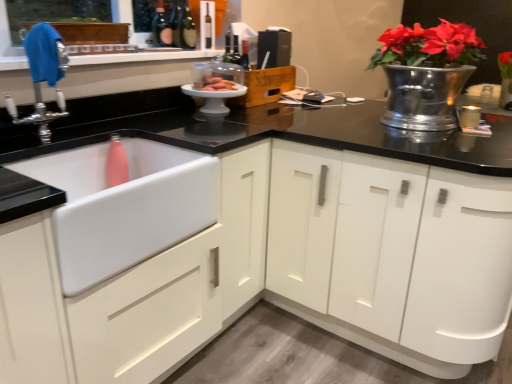
I want to click on white matte sink at lower left, so click(129, 213).

Image resolution: width=512 pixels, height=384 pixels. What do you see at coordinates (219, 85) in the screenshot?
I see `pink matte water bottle at center` at bounding box center [219, 85].

Find the location of a particular element. dark brown glass wine bottle at upper center is located at coordinates (187, 28).

What do you see at coordinates (187, 28) in the screenshot?
I see `dark brown glass wine bottle at upper center` at bounding box center [187, 28].

At what (x,y) coordinates should I click in order to perform the action: click on chrome metallic faucet at upper left. Please return your answer as a coordinate pair (x, y). Looking at the image, I should click on (42, 76).

What do you see at coordinates (42, 76) in the screenshot? I see `chrome metallic faucet at upper left` at bounding box center [42, 76].

Where is `white glossy cabinet at center`? Image resolution: width=512 pixels, height=384 pixels. white glossy cabinet at center is located at coordinates (392, 254).

You are a GUI agent. You are given a task and a screenshot of the screen. Output one action in this format:
    pyautogui.click(x=<x>, y=<y>)
    Task: Click on the white matte sink at lower left
    The height and width of the screenshot is (384, 512).
    Given the screenshot: What is the action you would take?
    pyautogui.click(x=129, y=213)

Is pink matte water bottle at center far away from dark brown glass wine bottle at upper center?

They are positioned close to each other.

Considering the relative sizes of pink matte water bottle at center and dark brown glass wine bottle at upper center in the image provided, is pink matte water bottle at center shorter than dark brown glass wine bottle at upper center?

Yes.

Considering the positions of points (230, 81) and (184, 4), is point (230, 81) farther from camera compared to point (184, 4)?

No, (230, 81) is in front of (184, 4).

From the image's perspective, which one is positioned lower, black matte speaker at upper center, which is counted as the 2th appliance, starting from the bottom, or white ceramic cake stand at center, marked as the second appliance in a back-to-front arrangement?

white ceramic cake stand at center, marked as the second appliance in a back-to-front arrangement.

The height and width of the screenshot is (384, 512). I want to click on appliance in front of the black matte speaker at upper center, marked as the 2th appliance in a front-to-back arrangement, so click(x=216, y=94).

Is black matte speaker at upper center, marked as the 2th appliance in a front-to-back arrangement, taller or shorter than white ceramic cake stand at center, the first appliance in the bottom-to-top sequence?

Considering their sizes, black matte speaker at upper center, marked as the 2th appliance in a front-to-back arrangement, has more height than white ceramic cake stand at center, the first appliance in the bottom-to-top sequence.

Relative to white ceramic cake stand at center, which appears as the 1th appliance when viewed from the front, is black matte speaker at upper center, which appears as the first appliance when viewed from the back, in front or behind?

Visually, black matte speaker at upper center, which appears as the first appliance when viewed from the back, is located behind white ceramic cake stand at center, which appears as the 1th appliance when viewed from the front.

Does point (138, 234) appear closer or farther from the camera than point (213, 106)?

Point (138, 234) is positioned closer to the camera compared to point (213, 106).

Considering the sizes of objects white matte sink at lower left and white ceramic cake stand at center, marked as the second appliance in a back-to-front arrangement, in the image provided, who is bigger, white matte sink at lower left or white ceramic cake stand at center, marked as the second appliance in a back-to-front arrangement,?

white matte sink at lower left.

Looking at this image, from the image's perspective, is white matte sink at lower left located beneath white ceramic cake stand at center, the first appliance in the bottom-to-top sequence?

Correct, white matte sink at lower left appears lower than white ceramic cake stand at center, the first appliance in the bottom-to-top sequence, in the image.

Consider the image. Is white matte sink at lower left shorter than white ceramic cake stand at center, the first appliance in the bottom-to-top sequence?

In fact, white matte sink at lower left may be taller than white ceramic cake stand at center, the first appliance in the bottom-to-top sequence.

Is dark brown glass wine bottle at upper center wider or thinner than white glossy cabinet at center?

Considering their sizes, dark brown glass wine bottle at upper center looks slimmer than white glossy cabinet at center.

Looking at this image, considering the sizes of objects dark brown glass wine bottle at upper center and white glossy cabinet at center in the image provided, who is smaller, dark brown glass wine bottle at upper center or white glossy cabinet at center?

dark brown glass wine bottle at upper center.

Between dark brown glass wine bottle at upper center and white glossy cabinet at center, which one has less height?

Standing shorter between the two is dark brown glass wine bottle at upper center.

In the scene shown: Is dark brown glass wine bottle at upper center positioned beyond the bounds of white glossy cabinet at center?

Yes, dark brown glass wine bottle at upper center is not within white glossy cabinet at center.

Between chrome metallic faucet at upper left and white ceramic cake stand at center, the 2th appliance in the top-to-bottom sequence, which one is positioned in front?

Positioned in front is chrome metallic faucet at upper left.

From a real-world perspective, who is located lower, chrome metallic faucet at upper left or white ceramic cake stand at center, marked as the second appliance in a back-to-front arrangement?

From a 3D spatial view, white ceramic cake stand at center, marked as the second appliance in a back-to-front arrangement, is below.

Does chrome metallic faucet at upper left have a lesser width compared to white ceramic cake stand at center, the first appliance in the bottom-to-top sequence?

Yes, chrome metallic faucet at upper left is thinner than white ceramic cake stand at center, the first appliance in the bottom-to-top sequence.

Which of these two, chrome metallic faucet at upper left or white ceramic cake stand at center, the first appliance in the bottom-to-top sequence, is smaller?

white ceramic cake stand at center, the first appliance in the bottom-to-top sequence.

Are white ceramic cake stand at center, the 2th appliance in the top-to-bottom sequence, and dark brown glass wine bottle at upper center far apart?

white ceramic cake stand at center, the 2th appliance in the top-to-bottom sequence, is near dark brown glass wine bottle at upper center, not far away.

Is white ceramic cake stand at center, which appears as the 1th appliance when viewed from the front, positioned with its back to dark brown glass wine bottle at upper center?

No, dark brown glass wine bottle at upper center is not at the back of white ceramic cake stand at center, which appears as the 1th appliance when viewed from the front.

Does white ceramic cake stand at center, the first appliance in the bottom-to-top sequence, appear on the right side of dark brown glass wine bottle at upper center?

Correct, you'll find white ceramic cake stand at center, the first appliance in the bottom-to-top sequence, to the right of dark brown glass wine bottle at upper center.

Could you measure the distance between white ceramic cake stand at center, the first appliance in the bottom-to-top sequence, and dark brown glass wine bottle at upper center?

white ceramic cake stand at center, the first appliance in the bottom-to-top sequence, is 16.03 inches from dark brown glass wine bottle at upper center.

Is white ceramic cake stand at center, the 2th appliance in the top-to-bottom sequence, at the back of shiny silver vase at upper right?

No, shiny silver vase at upper right's orientation is not away from white ceramic cake stand at center, the 2th appliance in the top-to-bottom sequence.

Identify the location of houseplant on the right of the white ceramic cake stand at center, marked as the second appliance in a back-to-front arrangement. (426, 73).

Consider the image. Would you say shiny silver vase at upper right is to the left or to the right of white ceramic cake stand at center, which appears as the 1th appliance when viewed from the front, in the picture?

Clearly, shiny silver vase at upper right is on the right of white ceramic cake stand at center, which appears as the 1th appliance when viewed from the front, in the image.

Considering the sizes of shiny silver vase at upper right and white ceramic cake stand at center, the first appliance in the bottom-to-top sequence, in the image, is shiny silver vase at upper right wider or thinner than white ceramic cake stand at center, the first appliance in the bottom-to-top sequence,?

In the image, shiny silver vase at upper right appears to be wider than white ceramic cake stand at center, the first appliance in the bottom-to-top sequence.

Identify the location of food that is on the right side of dark brown glass wine bottle at upper center. (219, 85).

Locate an element on the screen. The image size is (512, 384). appliance that appears below the black matte speaker at upper center, which appears as the first appliance when viewed from the back (from a real-world perspective) is located at coordinates (216, 94).

Based on their spatial positions, is white glossy cabinet at center or dark brown glass wine bottle at upper center closer to black matte speaker at upper center, placed as the 1th appliance when sorted from top to bottom?

The object closer to black matte speaker at upper center, placed as the 1th appliance when sorted from top to bottom, is dark brown glass wine bottle at upper center.

From the image, which object appears to be farther from white ceramic cake stand at center, the 2th appliance in the top-to-bottom sequence, pink matte water bottle at center or white glossy cabinet at center?

white glossy cabinet at center is further to white ceramic cake stand at center, the 2th appliance in the top-to-bottom sequence.

Based on their spatial positions, is shiny silver vase at upper right or chrome metallic faucet at upper left further from white ceramic cake stand at center, which appears as the 1th appliance when viewed from the front?

shiny silver vase at upper right lies further to white ceramic cake stand at center, which appears as the 1th appliance when viewed from the front, than the other object.

Which object lies nearer to the anchor point dark brown glass wine bottle at upper center, white matte sink at lower left or chrome metallic faucet at upper left?

Based on the image, chrome metallic faucet at upper left appears to be nearer to dark brown glass wine bottle at upper center.

Based on the photo, which object lies further to the anchor point white ceramic cake stand at center, marked as the second appliance in a back-to-front arrangement, black matte speaker at upper center, which is counted as the 2th appliance, starting from the bottom, or pink matte water bottle at center?

Among the two, black matte speaker at upper center, which is counted as the 2th appliance, starting from the bottom, is located further to white ceramic cake stand at center, marked as the second appliance in a back-to-front arrangement.

Which object lies nearer to the anchor point chrome metallic faucet at upper left, pink matte water bottle at center or shiny silver vase at upper right?

pink matte water bottle at center.

Based on the photo, looking at the image, which one is located further to black matte speaker at upper center, marked as the 2th appliance in a front-to-back arrangement, dark brown glass wine bottle at upper center or white ceramic cake stand at center, the first appliance in the bottom-to-top sequence?

The object further to black matte speaker at upper center, marked as the 2th appliance in a front-to-back arrangement, is dark brown glass wine bottle at upper center.

When comparing their distances from dark brown glass wine bottle at upper center, does white ceramic cake stand at center, marked as the second appliance in a back-to-front arrangement, or white glossy cabinet at center seem closer?

Based on the image, white ceramic cake stand at center, marked as the second appliance in a back-to-front arrangement, appears to be nearer to dark brown glass wine bottle at upper center.

At what (x,y) coordinates should I click in order to perform the action: click on cabinetry positioned between white matte sink at lower left and black matte speaker at upper center, which appears as the first appliance when viewed from the back, from near to far. Please return your answer as a coordinate pair (x, y). Looking at the image, I should click on (392, 254).

Find the location of a particular element. This screenshot has width=512, height=384. food between white ceramic cake stand at center, the first appliance in the bottom-to-top sequence, and black matte speaker at upper center, which appears as the first appliance when viewed from the back, along the z-axis is located at coordinates (219, 85).

The width and height of the screenshot is (512, 384). In order to click on houseplant between white matte sink at lower left and black matte speaker at upper center, placed as the 1th appliance when sorted from top to bottom, from front to back in this screenshot , I will do `click(426, 73)`.

The width and height of the screenshot is (512, 384). I want to click on food located between white glossy cabinet at center and dark brown glass wine bottle at upper center in the depth direction, so click(x=219, y=85).